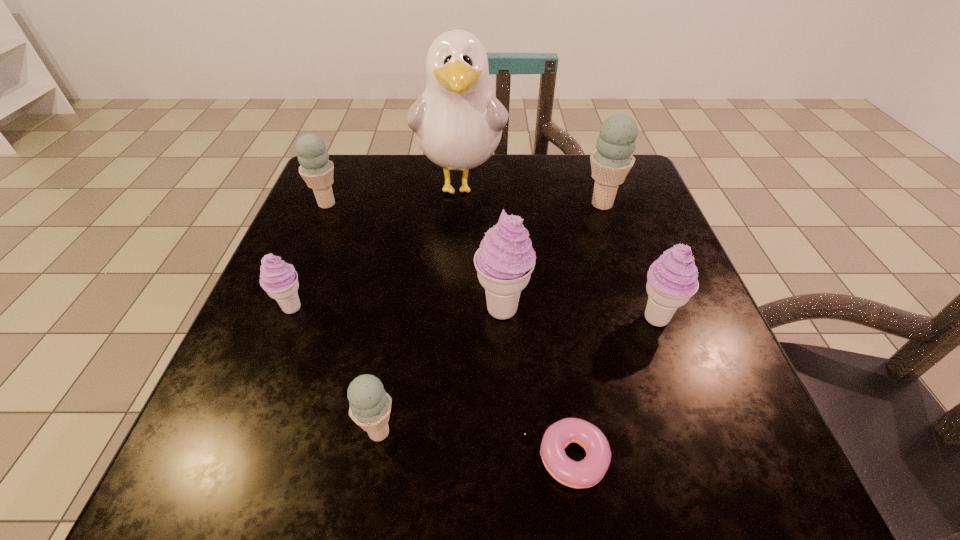
Identify which object is located as the seventh nearest to the second purple icecream from right to left. Please provide its 2D coordinates. Your answer should be formatted as a tuple, i.e. [(x, y)], where the tuple contains the x and y coordinates of a point satisfying the conditions above.

[(316, 169)]

Where is `the second closest ice cream to the second purple icecream from left to right`? The image size is (960, 540). the second closest ice cream to the second purple icecream from left to right is located at coordinates (370, 405).

Find the location of a particular element. the fifth closest ice cream to the doughnut is located at coordinates (612, 160).

Find the location of a particular element. Image resolution: width=960 pixels, height=540 pixels. blue ice cream that is the second closest one to the rightmost blue ice cream is located at coordinates (370, 405).

Identify which blue ice cream is the third nearest to the leftmost purple icecream. Please provide its 2D coordinates. Your answer should be formatted as a tuple, i.e. [(x, y)], where the tuple contains the x and y coordinates of a point satisfying the conditions above.

[(612, 160)]

You are a GUI agent. You are given a task and a screenshot of the screen. Output one action in this format:
    pyautogui.click(x=<x>, y=<y>)
    Task: Click on the purple icecream that is the second closest to the second smallest purple icecream
    The image size is (960, 540).
    Given the screenshot: What is the action you would take?
    click(280, 280)

Select which purple icecream is the third closest to the white gull. Please provide its 2D coordinates. Your answer should be formatted as a tuple, i.e. [(x, y)], where the tuple contains the x and y coordinates of a point satisfying the conditions above.

[(672, 279)]

Where is `free location that satisfies the following two spatial constraints: 1. on the beak of the gull; 2. on the left side of the rightmost purple icecream`? free location that satisfies the following two spatial constraints: 1. on the beak of the gull; 2. on the left side of the rightmost purple icecream is located at coordinates (453, 318).

Locate an element on the screen. This screenshot has height=540, width=960. vacant space that satisfies the following two spatial constraints: 1. on the front side of the leftmost purple icecream; 2. on the right side of the fourth ice cream from left to right is located at coordinates click(x=291, y=309).

Image resolution: width=960 pixels, height=540 pixels. I want to click on vacant space that satisfies the following two spatial constraints: 1. on the front side of the second smallest purple icecream; 2. on the right side of the biggest blue ice cream, so click(639, 318).